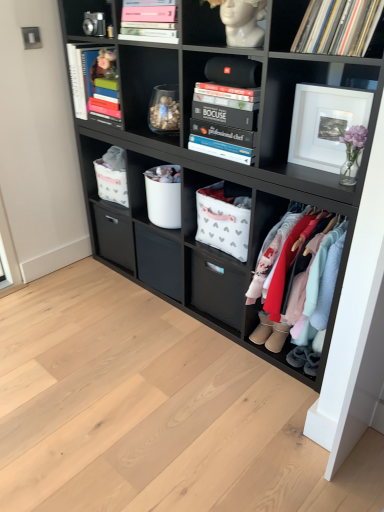
Question: Is gray suede booties at lower right, which is counted as the first footwear, starting from the right, inside the boundaries of white fabric basket at center, the 5th shelf viewed from the top, or outside?

Choices:
 (A) outside
 (B) inside

Answer: (A)

Question: From a real-world perspective, is gray suede booties at lower right, placed as the 1th footwear when sorted from bottom to top, above or below white fabric basket at center, the 5th shelf viewed from the top?

Choices:
 (A) below
 (B) above

Answer: (A)

Question: Estimate the real-world distances between objects in this image. Which object is closer to the hardcover book at upper left, the 1th magazine positioned from the left?

Choices:
 (A) pink matte book at upper center, acting as the first magazine starting from the right
 (B) black vinyl records at upper right, the first shelf in the top-to-bottom sequence
 (C) white matte picture frame at upper right
 (D) velvet-like fabric clothes at right, the first shelf from the bottom
 (E) white fabric basket at center, which ranks as the 2th shelf in bottom-to-top order

Answer: (A)

Question: Which object is the closest to the white matte picture frame at upper right?

Choices:
 (A) white fabric basket at center, the 5th shelf viewed from the top
 (B) hardcover book at upper left, the second magazine positioned from the right
 (C) metallic silver camera at upper left
 (D) pink matte book at upper center, which is the second magazine from left to right
 (E) gray suede booties at lower right, which is counted as the first footwear, starting from the right

Answer: (A)